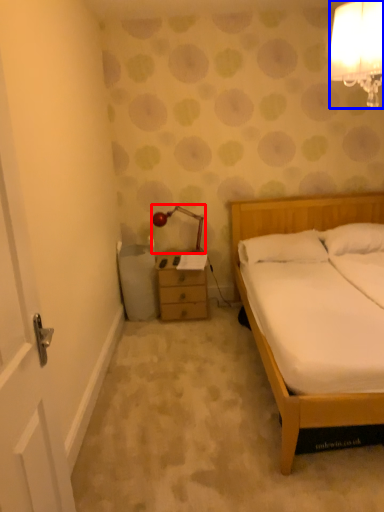
Question: Which of the following is the closest to the observer, lamp (highlighted by a red box) or lamp (highlighted by a blue box)?

Choices:
 (A) lamp
 (B) lamp

Answer: (B)